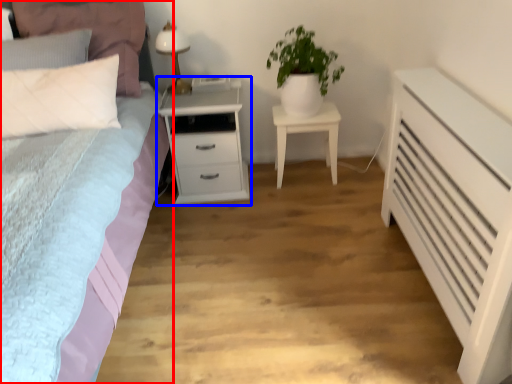
Question: Which object is further to the camera taking this photo, bed (highlighted by a red box) or nightstand (highlighted by a blue box)?

Choices:
 (A) bed
 (B) nightstand

Answer: (B)